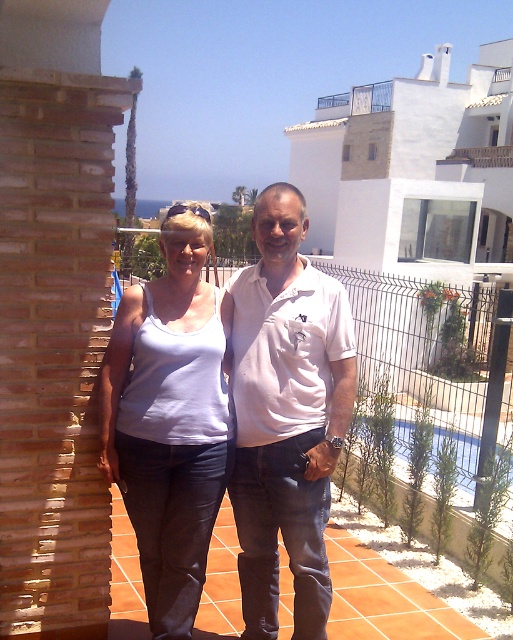
Between white cotton polo shirt at center and white matte tank top at center, which one is positioned lower?

Positioned lower is white cotton polo shirt at center.

Between point (284, 324) and point (107, 468), which one is positioned in front?

Point (284, 324) is more forward.

Identify the location of white cotton polo shirt at center. This screenshot has height=640, width=513. (286, 413).

Is white matte tank top at center taller than white painted wood at upper right?

Yes, white matte tank top at center is taller than white painted wood at upper right.

Who is lower down, white matte tank top at center or white painted wood at upper right?

white matte tank top at center is below.

At what (x,y) coordinates should I click in order to perform the action: click on white matte tank top at center. Please return your answer as a coordinate pair (x, y). Looking at the image, I should click on (169, 420).

Find the location of a particular element. This screenshot has width=513, height=640. white matte tank top at center is located at coordinates (169, 420).

Who is positioned more to the right, white cotton polo shirt at center or white painted wood at upper right?

white painted wood at upper right

Consider the image. Does white cotton polo shirt at center have a lesser height compared to white painted wood at upper right?

In fact, white cotton polo shirt at center may be taller than white painted wood at upper right.

Based on the photo, who is more distant from viewer, [266,410] or [466,154]?

Point [466,154]

Identify the location of white cotton polo shirt at center. (286, 413).